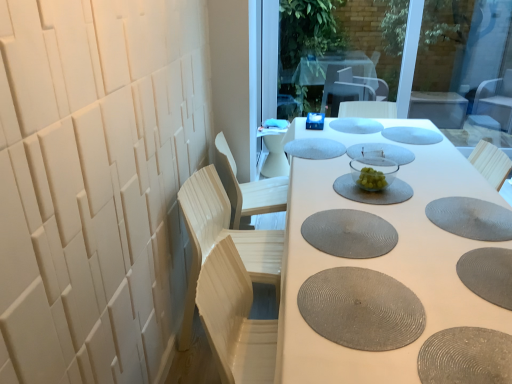
Question: Can we say light wood swivel chair at left lies outside clear glass bowl at center?

Choices:
 (A) no
 (B) yes

Answer: (B)

Question: Is light wood swivel chair at left facing away from clear glass bowl at center?

Choices:
 (A) no
 (B) yes

Answer: (A)

Question: Are light wood swivel chair at left and clear glass bowl at center beside each other?

Choices:
 (A) yes
 (B) no

Answer: (B)

Question: From the image's perspective, is light wood swivel chair at left beneath clear glass bowl at center?

Choices:
 (A) yes
 (B) no

Answer: (A)

Question: Is clear glass bowl at center surrounded by light wood swivel chair at left?

Choices:
 (A) no
 (B) yes

Answer: (A)

Question: From a real-world perspective, is light wood swivel chair at left located higher than clear glass bowl at center?

Choices:
 (A) no
 (B) yes

Answer: (A)

Question: Are matte gray placemat at center and gray textured placemat at lower right, the eighth manhole cover in the back-to-front sequence, making contact?

Choices:
 (A) no
 (B) yes

Answer: (A)

Question: Is matte gray placemat at center bigger than gray textured placemat at lower right, placed as the third manhole cover when sorted from front to back?

Choices:
 (A) no
 (B) yes

Answer: (B)

Question: Is matte gray placemat at center thinner than gray textured placemat at lower right, placed as the third manhole cover when sorted from front to back?

Choices:
 (A) yes
 (B) no

Answer: (B)

Question: Would you say matte gray placemat at center is outside gray textured placemat at lower right, placed as the third manhole cover when sorted from front to back?

Choices:
 (A) yes
 (B) no

Answer: (A)

Question: Is matte gray placemat at center aimed at gray textured placemat at lower right, placed as the third manhole cover when sorted from front to back?

Choices:
 (A) no
 (B) yes

Answer: (A)

Question: Can you confirm if matte gray placemat at center is positioned to the right of gray textured placemat at lower right, placed as the third manhole cover when sorted from front to back?

Choices:
 (A) yes
 (B) no

Answer: (B)

Question: Considering the relative positions of gray textured placemat at center, placed as the seventh manhole cover when sorted from back to front, and transparent glass window screen at upper center in the image provided, is gray textured placemat at center, placed as the seventh manhole cover when sorted from back to front, to the left of transparent glass window screen at upper center from the viewer's perspective?

Choices:
 (A) yes
 (B) no

Answer: (A)